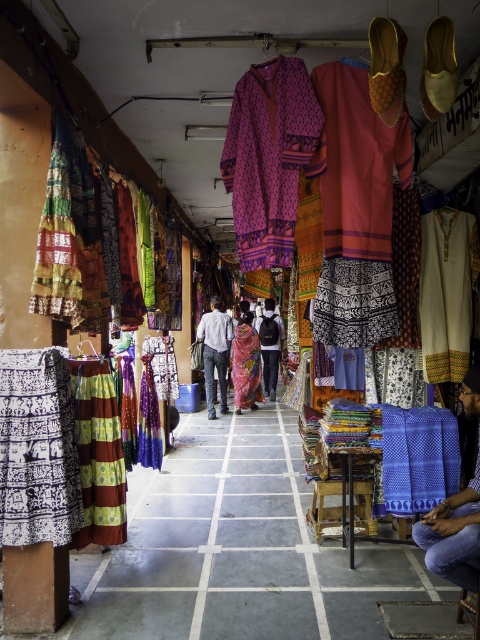
Does denim jeans at center have a lesser width compared to matte pink fabric at center?

No.

Which is above, denim jeans at center or matte pink fabric at center?

matte pink fabric at center

Does point (205, 371) lie behind point (276, 332)?

No, it is not.

Where is `denim jeans at center`? Image resolution: width=480 pixels, height=640 pixels. denim jeans at center is located at coordinates (215, 352).

Which is below, blue woven fabric at lower right or denim jeans at center?

blue woven fabric at lower right is lower down.

Does blue woven fabric at lower right appear over denim jeans at center?

No, blue woven fabric at lower right is not above denim jeans at center.

Image resolution: width=480 pixels, height=640 pixels. What do you see at coordinates (454, 538) in the screenshot?
I see `blue woven fabric at lower right` at bounding box center [454, 538].

The image size is (480, 640). Identify the location of blue woven fabric at lower right. (454, 538).

Between point (432, 566) and point (252, 355), which one is positioned behind?

Positioned behind is point (252, 355).

The width and height of the screenshot is (480, 640). I want to click on blue woven fabric at lower right, so click(454, 538).